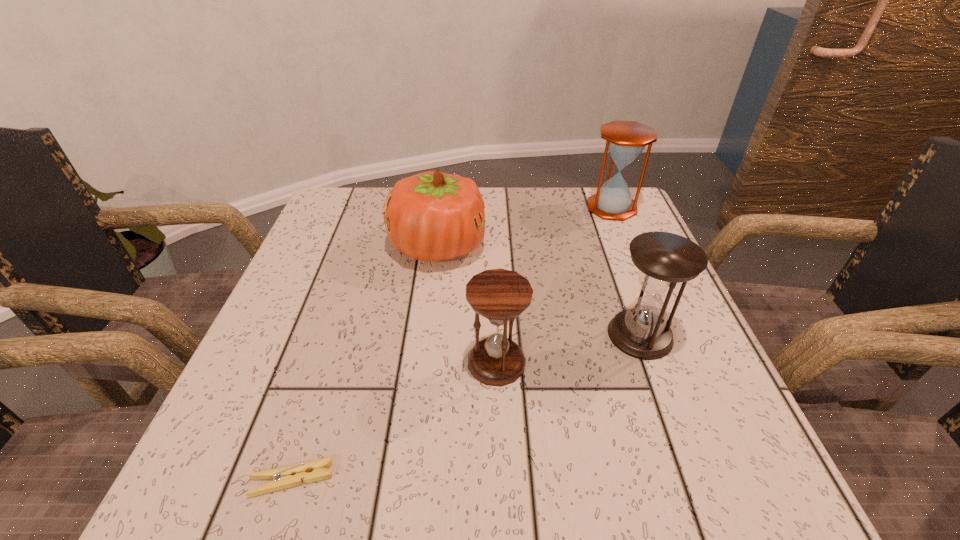
Where is `the farthest hourglass`? The width and height of the screenshot is (960, 540). the farthest hourglass is located at coordinates (625, 140).

Where is `pumpkin`? This screenshot has width=960, height=540. pumpkin is located at coordinates (432, 216).

Locate an element on the screen. the leftmost hourglass is located at coordinates (500, 295).

Locate an element on the screen. the shortest object is located at coordinates (289, 476).

Locate an element on the screen. This screenshot has width=960, height=540. clothespin is located at coordinates (289, 476).

The width and height of the screenshot is (960, 540). Identify the location of vacant space located 0.300m on the front of the farthest hourglass. (654, 308).

At what (x,y) coordinates should I click in order to perform the action: click on free space located 0.140m on the side of the pumpkin with the cute face. Please return your answer as a coordinate pair (x, y). Image resolution: width=960 pixels, height=540 pixels. Looking at the image, I should click on (546, 246).

Locate an element on the screen. Image resolution: width=960 pixels, height=540 pixels. vacant space located 0.350m on the left of the leftmost hourglass is located at coordinates (264, 362).

In order to click on free point located 0.390m on the right of the nearest object in this screenshot , I will do `click(615, 480)`.

Where is `hourglass located at the far edge`? The height and width of the screenshot is (540, 960). hourglass located at the far edge is located at coordinates (625, 140).